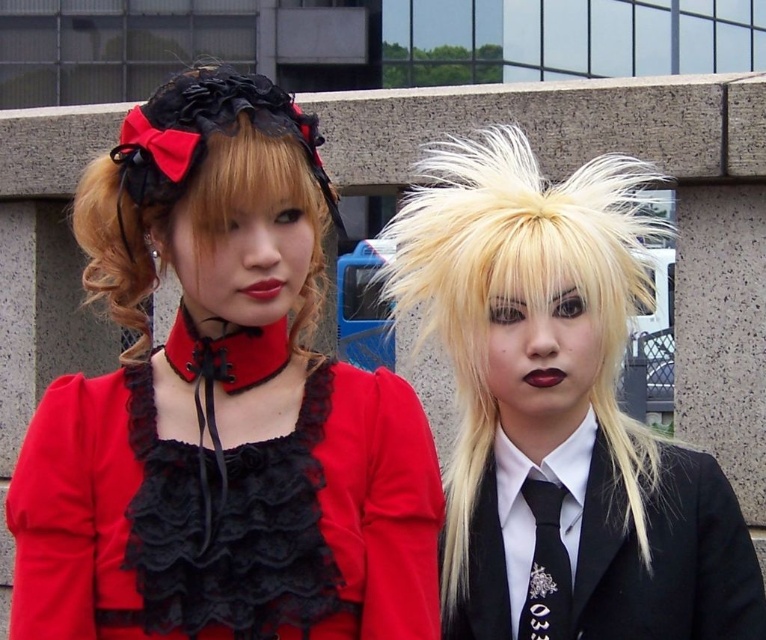
In the scene shown: Measure the distance between black lace dress at center and camera.

The distance of black lace dress at center from camera is 6.30 meters.

Who is shorter, black lace dress at center or black satin tie at center?

Standing shorter between the two is black satin tie at center.

Which is in front, point (210, 548) or point (526, 624)?

Point (210, 548)

Locate an element on the screen. This screenshot has width=766, height=640. black lace dress at center is located at coordinates (231, 525).

Is point (228, 568) positioned after point (228, 97)?

No, it is not.

Between point (146, 548) and point (139, 353), which one is positioned in front?

Point (146, 548) is more forward.

At what (x,y) coordinates should I click in order to perform the action: click on black lace dress at center. Please return your answer as a coordinate pair (x, y). The width and height of the screenshot is (766, 640). Looking at the image, I should click on (231, 525).

Can you confirm if black satin business suit at right is bigger than black satin tie at center?

Correct, black satin business suit at right is larger in size than black satin tie at center.

Does black satin business suit at right appear on the right side of black satin tie at center?

Indeed, black satin business suit at right is positioned on the right side of black satin tie at center.

Image resolution: width=766 pixels, height=640 pixels. Describe the element at coordinates (663, 556) in the screenshot. I see `black satin business suit at right` at that location.

Locate an element on the screen. black satin business suit at right is located at coordinates (663, 556).